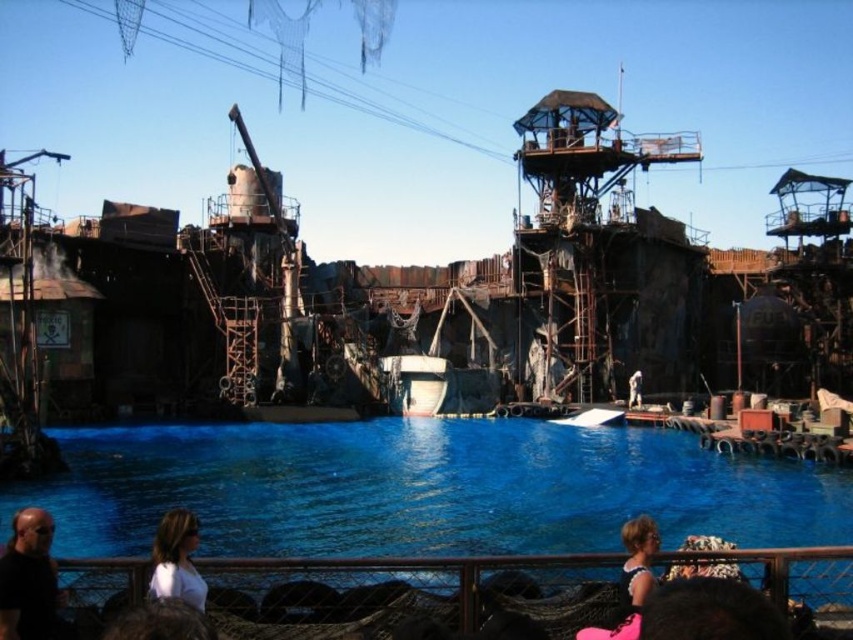
Question: Does blue liquid water at center appear on the right side of white matte shirt at lower left?

Choices:
 (A) no
 (B) yes

Answer: (B)

Question: Among these points, which one is nearest to the camera?

Choices:
 (A) (321, 435)
 (B) (22, 582)
 (C) (200, 608)

Answer: (B)

Question: Among these points, which one is nearest to the camera?

Choices:
 (A) (198, 586)
 (B) (47, 525)
 (C) (469, 488)
 (D) (624, 524)

Answer: (A)

Question: Which point is farther from the camera taking this photo?

Choices:
 (A) (171, 550)
 (B) (619, 529)
 (C) (15, 548)
 (D) (572, 529)

Answer: (B)

Question: Is blue liquid water at center to the right of dark hair at lower left from the viewer's perspective?

Choices:
 (A) no
 (B) yes

Answer: (B)

Question: Does dark hair at lower left have a greater width compared to blonde hair at lower center?

Choices:
 (A) yes
 (B) no

Answer: (B)